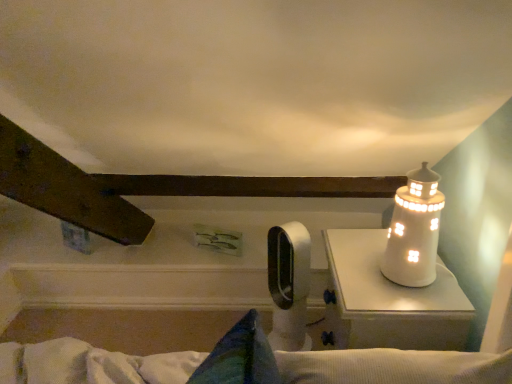
I want to click on spots to the right of white ceramic lighthouse at upper right, so click(x=450, y=282).